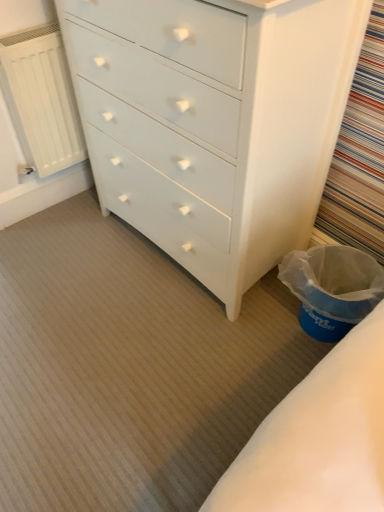
Question: Is white matte radiator at left at the back of white painted wood chest of drawers at center?

Choices:
 (A) no
 (B) yes

Answer: (A)

Question: From a real-world perspective, is white painted wood chest of drawers at center below white matte radiator at left?

Choices:
 (A) yes
 (B) no

Answer: (B)

Question: Is there a large distance between white painted wood chest of drawers at center and white matte radiator at left?

Choices:
 (A) no
 (B) yes

Answer: (A)

Question: Are white painted wood chest of drawers at center and white matte radiator at left making contact?

Choices:
 (A) yes
 (B) no

Answer: (B)

Question: Is white painted wood chest of drawers at center to the right of white matte radiator at left from the viewer's perspective?

Choices:
 (A) no
 (B) yes

Answer: (B)

Question: Considering the relative positions of white painted wood chest of drawers at center and white matte radiator at left in the image provided, is white painted wood chest of drawers at center in front of white matte radiator at left?

Choices:
 (A) no
 (B) yes

Answer: (B)

Question: Could you tell me if white matte radiator at left is facing blue plastic laundry basket at lower right?

Choices:
 (A) yes
 (B) no

Answer: (A)

Question: Are white matte radiator at left and blue plastic laundry basket at lower right far apart?

Choices:
 (A) yes
 (B) no

Answer: (A)

Question: From the image's perspective, is white matte radiator at left under blue plastic laundry basket at lower right?

Choices:
 (A) yes
 (B) no

Answer: (B)

Question: Is white matte radiator at left shorter than blue plastic laundry basket at lower right?

Choices:
 (A) no
 (B) yes

Answer: (A)

Question: Considering the relative sizes of white matte radiator at left and blue plastic laundry basket at lower right in the image provided, is white matte radiator at left thinner than blue plastic laundry basket at lower right?

Choices:
 (A) yes
 (B) no

Answer: (A)

Question: Is white matte radiator at left bigger than blue plastic laundry basket at lower right?

Choices:
 (A) yes
 (B) no

Answer: (B)

Question: From the image's perspective, is blue plastic laundry basket at lower right located above white painted wood chest of drawers at center?

Choices:
 (A) no
 (B) yes

Answer: (A)